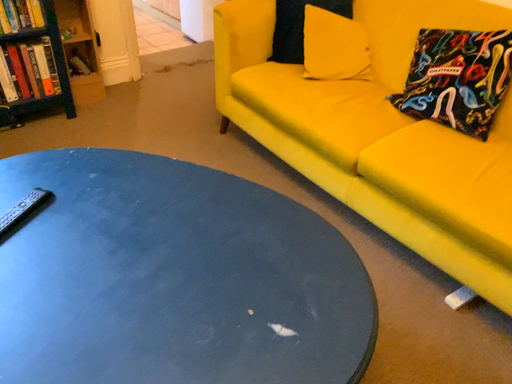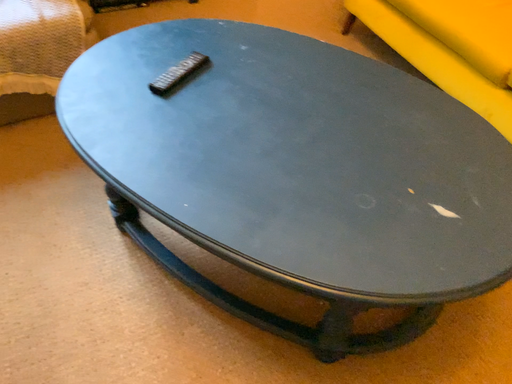
Question: How did the camera likely rotate when shooting the video?

Choices:
 (A) rotated downward
 (B) rotated upward

Answer: (A)